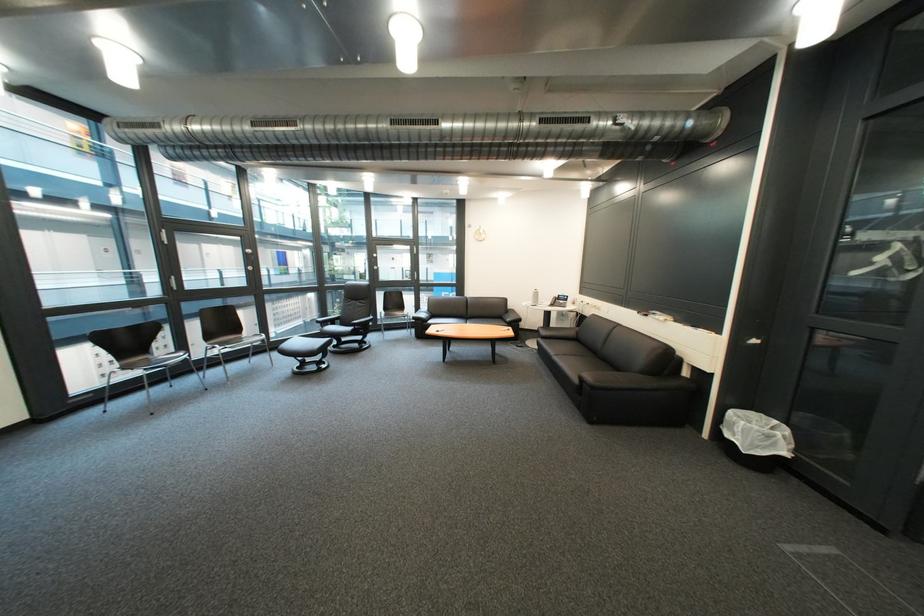
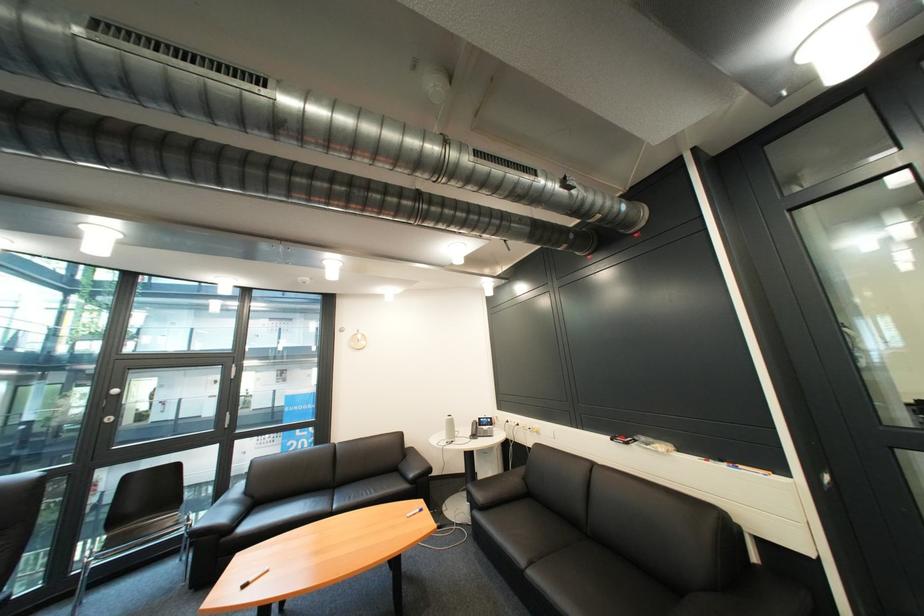
Where in the second image is the point corresponding to (573,297) from the first image?

(492, 419)